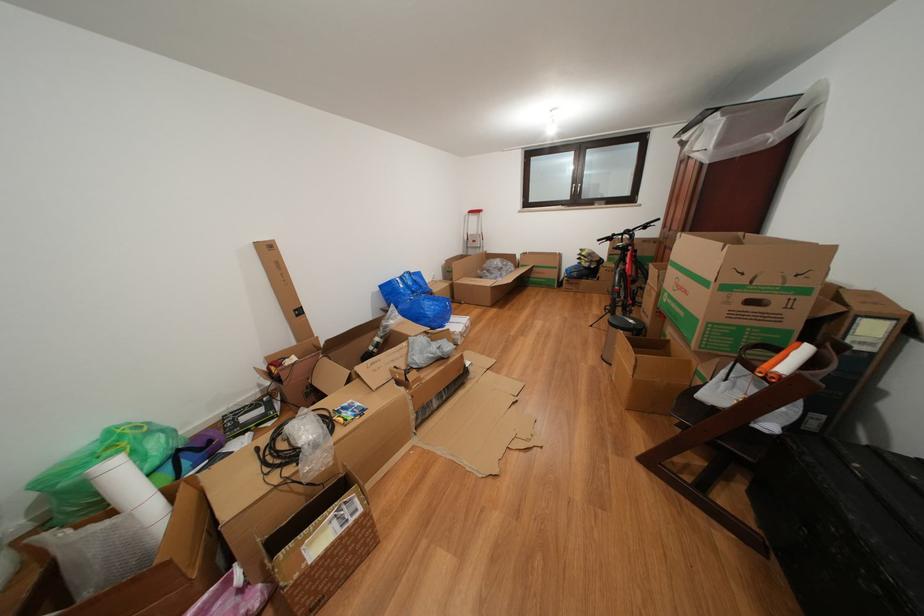
Find where to lift the blue plastic bag. Please return your answer as a coordinate pair (x, y).

(416, 300)